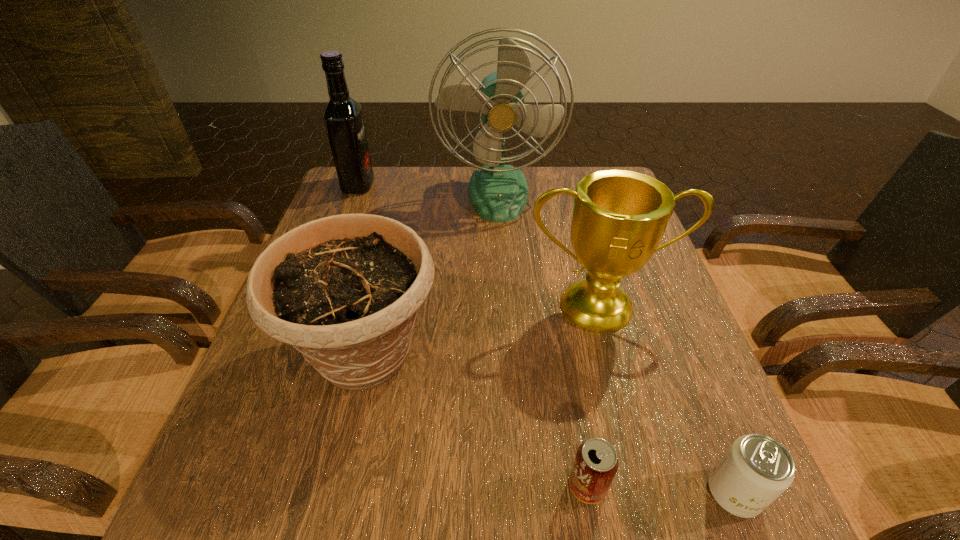
The width and height of the screenshot is (960, 540). In the image, there is a desktop. What are the coordinates of `free region at the far edge` in the screenshot? It's located at (535, 180).

Where is `free space at the near edge of the desktop`? The image size is (960, 540). free space at the near edge of the desktop is located at coordinates (x=573, y=509).

The image size is (960, 540). I want to click on vacant space at the left edge, so click(x=241, y=442).

Find the location of a particular element. The image size is (960, 540). vacant space at the far left corner of the desktop is located at coordinates click(x=358, y=200).

At what (x,y) coordinates should I click in order to perform the action: click on vacant space at the near left corner. Please return your answer as a coordinate pair (x, y). The image size is (960, 540). Looking at the image, I should click on (214, 539).

Find the location of a particular element. This screenshot has height=540, width=960. free space at the near right corner of the desktop is located at coordinates (684, 534).

The width and height of the screenshot is (960, 540). In order to click on free space that is in between the liquor and the fourth shortest object in this screenshot , I will do `click(478, 246)`.

The width and height of the screenshot is (960, 540). I want to click on empty space that is in between the second tallest object and the tallest object, so click(x=428, y=190).

This screenshot has height=540, width=960. I want to click on empty location between the fourth shortest object and the fourth tallest object, so click(x=482, y=330).

This screenshot has width=960, height=540. Identify the location of free space between the third tallest object and the fan. (548, 250).